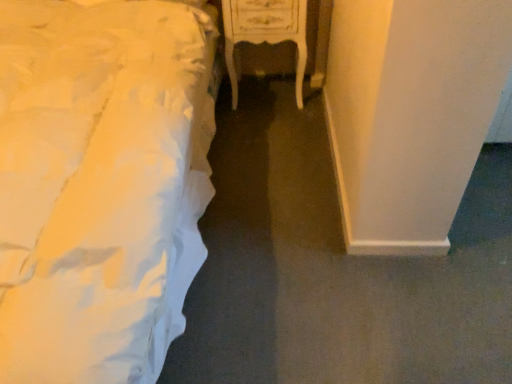
Question: Considering the relative sizes of white fabric bed at left and white glossy nightstand at center in the image provided, is white fabric bed at left wider than white glossy nightstand at center?

Choices:
 (A) no
 (B) yes

Answer: (B)

Question: Is white fabric bed at left at the left side of white glossy nightstand at center?

Choices:
 (A) no
 (B) yes

Answer: (B)

Question: From the image's perspective, does white fabric bed at left appear lower than white glossy nightstand at center?

Choices:
 (A) no
 (B) yes

Answer: (B)

Question: Is white fabric bed at left completely or partially outside of white glossy nightstand at center?

Choices:
 (A) no
 (B) yes

Answer: (B)

Question: From the image's perspective, would you say white fabric bed at left is positioned over white glossy nightstand at center?

Choices:
 (A) no
 (B) yes

Answer: (A)

Question: Is white fabric bed at left positioned with its back to white glossy nightstand at center?

Choices:
 (A) no
 (B) yes

Answer: (A)

Question: Can you confirm if white glossy nightstand at center is positioned to the right of white fabric bed at left?

Choices:
 (A) no
 (B) yes

Answer: (B)

Question: Is white glossy nightstand at center not close to white fabric bed at left?

Choices:
 (A) no
 (B) yes

Answer: (A)

Question: Is white glossy nightstand at center closer to camera compared to white fabric bed at left?

Choices:
 (A) no
 (B) yes

Answer: (A)

Question: Is white glossy nightstand at center bigger than white fabric bed at left?

Choices:
 (A) no
 (B) yes

Answer: (A)

Question: From a real-world perspective, is white glossy nightstand at center physically above white fabric bed at left?

Choices:
 (A) no
 (B) yes

Answer: (A)

Question: Considering the relative sizes of white glossy nightstand at center and white fabric bed at left in the image provided, is white glossy nightstand at center taller than white fabric bed at left?

Choices:
 (A) no
 (B) yes

Answer: (A)

Question: From the image's perspective, relative to white glossy nightstand at center, is white fabric bed at left above or below?

Choices:
 (A) above
 (B) below

Answer: (B)